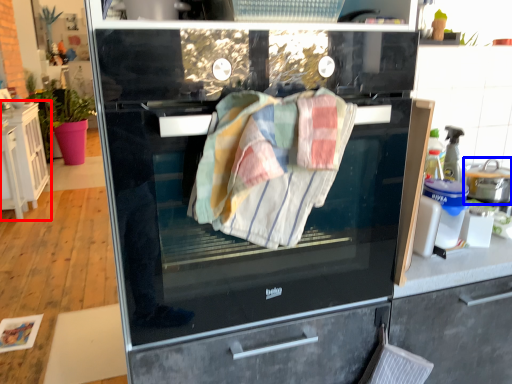
Question: Which object appears closest to the camera in this image, cabinetry (highlighted by a red box) or kitchen appliance (highlighted by a blue box)?

Choices:
 (A) cabinetry
 (B) kitchen appliance

Answer: (B)